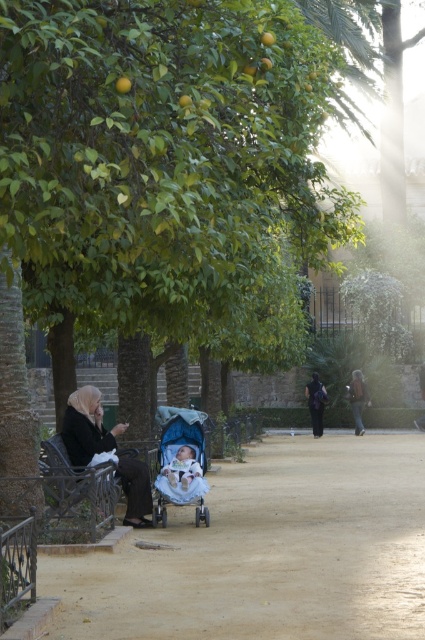
Question: Which object appears closest to the camera in this image?

Choices:
 (A) black wrought iron bench at lower left
 (B) black fabric person at center

Answer: (A)

Question: Which point is farther to the camera?

Choices:
 (A) blue fabric stroller at center
 (B) soft white baby at center

Answer: (B)

Question: Which point is closer to the camera taking this photo?

Choices:
 (A) (73, 465)
 (B) (204, 419)
 (C) (291, 632)

Answer: (C)

Question: From the image, what is the correct spatial relationship of smooth blue stroller at center in relation to black fabric person at center?

Choices:
 (A) right
 (B) left

Answer: (B)

Question: Can you confirm if smooth blue stroller at center is bigger than soft white baby at center?

Choices:
 (A) yes
 (B) no

Answer: (A)

Question: Can you confirm if soft white baby at center is wider than black fabric person at center?

Choices:
 (A) no
 (B) yes

Answer: (A)